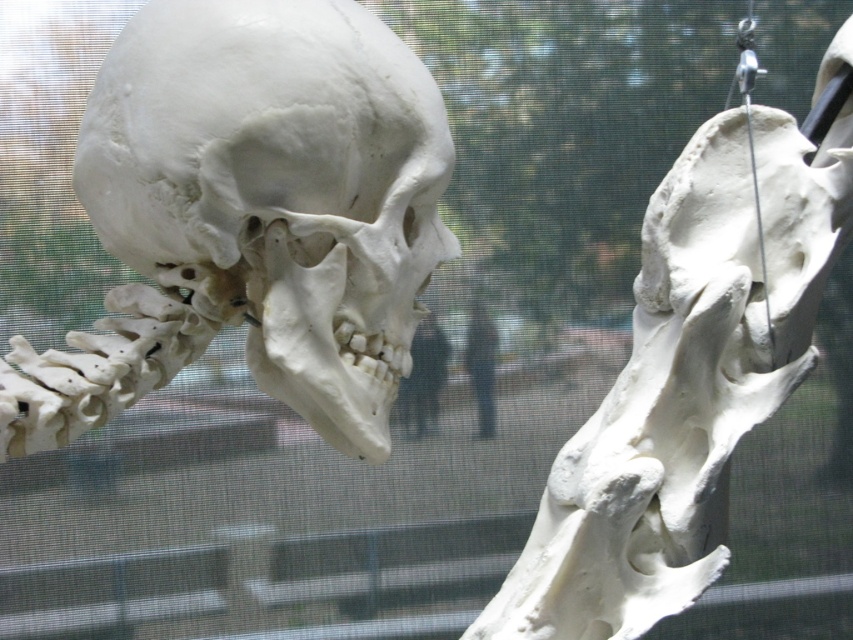
Is white matte skull at upper left further to camera compared to white bone at right?

No, white matte skull at upper left is closer to the viewer.

This screenshot has width=853, height=640. What do you see at coordinates (251, 216) in the screenshot?
I see `white matte skull at upper left` at bounding box center [251, 216].

In order to click on white matte skull at upper left in this screenshot , I will do `click(251, 216)`.

Between white matte skull at upper left and dark blue jeans at center, which one is positioned lower?

dark blue jeans at center is lower down.

Does white matte skull at upper left appear under dark blue jeans at center?

No, white matte skull at upper left is not below dark blue jeans at center.

What do you see at coordinates (251, 216) in the screenshot? I see `white matte skull at upper left` at bounding box center [251, 216].

Locate an element on the screen. white matte skull at upper left is located at coordinates (251, 216).

Does white bone at right have a lesser height compared to black matte person at center?

Incorrect, white bone at right's height does not fall short of black matte person at center's.

Who is taller, white bone at right or black matte person at center?

With more height is white bone at right.

Identify the location of white bone at right. (689, 372).

The image size is (853, 640). I want to click on white bone at right, so (x=689, y=372).